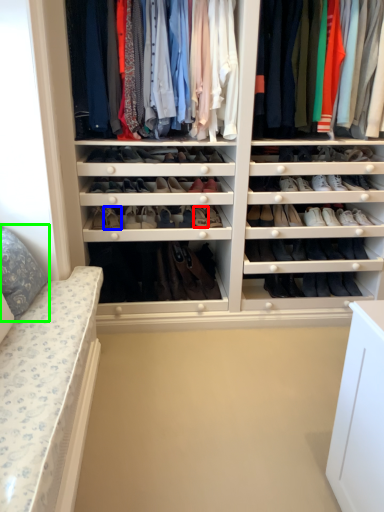
Question: Considering the real-world distances, which object is closest to shoe (highlighted by a red box)? shoe (highlighted by a blue box) or pillow (highlighted by a green box).

Choices:
 (A) shoe
 (B) pillow

Answer: (A)